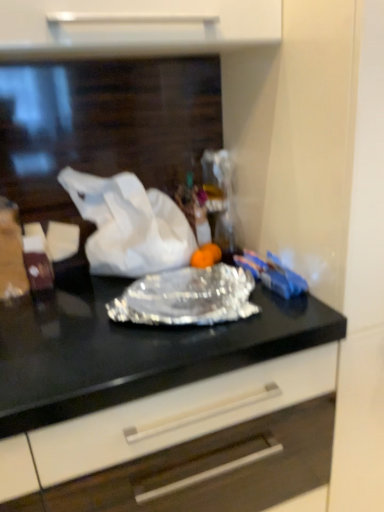
Identify the location of shiny metallic foil at center. The height and width of the screenshot is (512, 384). (131, 349).

Locate an element on the screen. white paper at center is located at coordinates (129, 225).

Which is in front, silver foil wrap at center or shiny metallic foil at center?

shiny metallic foil at center is closer to the camera.

From a real-world perspective, which is physically above, silver foil wrap at center or shiny metallic foil at center?

In real-world perspective, silver foil wrap at center is above.

From the image's perspective, which one is positioned lower, silver foil wrap at center or shiny metallic foil at center?

shiny metallic foil at center appears lower in the image.

Is silver foil wrap at center looking in the opposite direction of shiny metallic foil at center?

silver foil wrap at center does not have its back to shiny metallic foil at center.

Choose the correct answer: Is shiny metallic foil at center inside silver foil wrap at center or outside it?

shiny metallic foil at center cannot be found inside silver foil wrap at center.

How much distance is there between shiny metallic foil at center and silver foil wrap at center?

A distance of 4.45 inches exists between shiny metallic foil at center and silver foil wrap at center.

The image size is (384, 512). Find the location of `wrap to the right of shiny metallic foil at center`. wrap to the right of shiny metallic foil at center is located at coordinates (187, 297).

Which of these two, shiny metallic foil at center or silver foil wrap at center, is smaller?

Smaller between the two is silver foil wrap at center.

Is shiny metallic foil at center looking in the opposite direction of white paper at center?

shiny metallic foil at center is not turned away from white paper at center.

Is shiny metallic foil at center far away from white paper at center?

No, shiny metallic foil at center is in close proximity to white paper at center.

From a real-world perspective, is shiny metallic foil at center above or below white paper at center?

A: Clearly, from a real-world perspective, shiny metallic foil at center is below white paper at center.

From the image's perspective, is shiny metallic foil at center located above or below white paper at center?

shiny metallic foil at center is situated lower than white paper at center in the image.

What's the angular difference between silver foil wrap at center and white paper at center's facing directions?

There is a 0.000348-degree angle between the facing directions of silver foil wrap at center and white paper at center.

Is silver foil wrap at center beside white paper at center?

→ silver foil wrap at center and white paper at center are not in contact.

Which of these two, silver foil wrap at center or white paper at center, is wider?

silver foil wrap at center.

Is silver foil wrap at center behind white paper at center?

No, it is not.

Image resolution: width=384 pixels, height=512 pixels. In order to click on wrapping paper above the shiny metallic foil at center (from the image's perspective) in this screenshot , I will do click(129, 225).

Considering the positions of objects white paper at center and shiny metallic foil at center in the image provided, who is more to the right, white paper at center or shiny metallic foil at center?

shiny metallic foil at center is more to the right.

Consider the image. Measure the distance from white paper at center to shiny metallic foil at center.

white paper at center is 22.78 centimeters away from shiny metallic foil at center.

How many degrees apart are the facing directions of white paper at center and silver foil wrap at center?

The facing directions of white paper at center and silver foil wrap at center are 0.000348 degrees apart.

Is white paper at center with silver foil wrap at center?

No, white paper at center is not with silver foil wrap at center.

From the picture: Is white paper at center looking in the opposite direction of silver foil wrap at center?

white paper at center is not turned away from silver foil wrap at center.

Considering the relative positions of white paper at center and silver foil wrap at center in the image provided, is white paper at center to the right of silver foil wrap at center from the viewer's perspective?

In fact, white paper at center is to the left of silver foil wrap at center.

Find the location of a particular element. The height and width of the screenshot is (512, 384). wrap on the right of shiny metallic foil at center is located at coordinates (187, 297).

You are a GUI agent. You are given a task and a screenshot of the screen. Output one action in this format:
    pyautogui.click(x=<x>, y=<y>)
    Task: Click on the countertop on the left side of silver foil wrap at center
    
    Given the screenshot: What is the action you would take?
    pyautogui.click(x=131, y=349)

From the image, which object appears to be nearer to shiny metallic foil at center, white paper at center or silver foil wrap at center?

silver foil wrap at center lies closer to shiny metallic foil at center than the other object.

Considering their positions, is white paper at center positioned further to silver foil wrap at center than shiny metallic foil at center?

white paper at center is further to silver foil wrap at center.

Looking at the image, which one is located further to shiny metallic foil at center, silver foil wrap at center or white paper at center?

white paper at center.

Considering their positions, is shiny metallic foil at center positioned further to white paper at center than silver foil wrap at center?

Based on the image, shiny metallic foil at center appears to be further to white paper at center.

Estimate the real-world distances between objects in this image. Which object is closer to white paper at center, silver foil wrap at center or shiny metallic foil at center?

Based on the image, silver foil wrap at center appears to be nearer to white paper at center.

Considering their positions, is shiny metallic foil at center positioned closer to silver foil wrap at center than white paper at center?

shiny metallic foil at center lies closer to silver foil wrap at center than the other object.

This screenshot has height=512, width=384. What are the coordinates of `wrap between white paper at center and shiny metallic foil at center in the up-down direction` in the screenshot? It's located at (187, 297).